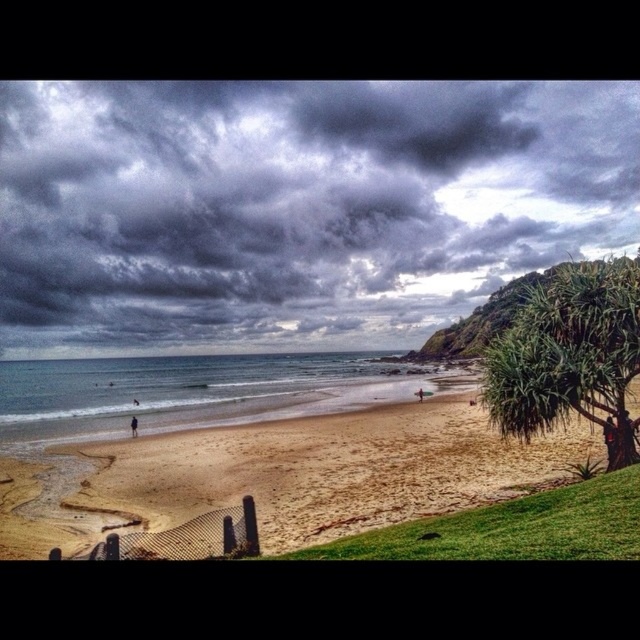
Consider the image. You are planning to build a small sandcastle on the beach. Given the available space, which area would be more suitable for constructing a larger base, the sandy beach at lower left or the blue water at beach center?

The blue water at beach center occupies more space than the sandy beach at lower left, making it more suitable for constructing a larger sandcastle base.

You are standing on the beach and notice the dark gray cloud at upper center and the dark blue fabric at lower left. Which object is higher in the scene?

The dark gray cloud at upper center is higher than the dark blue fabric at lower left because it is positioned above it.